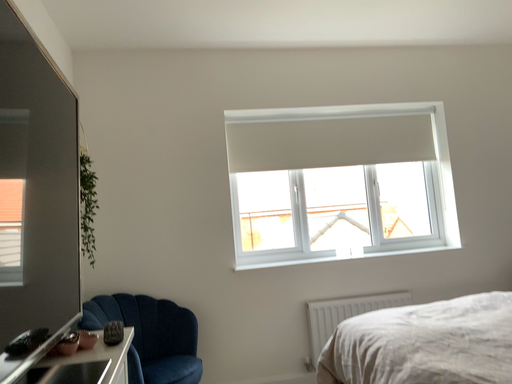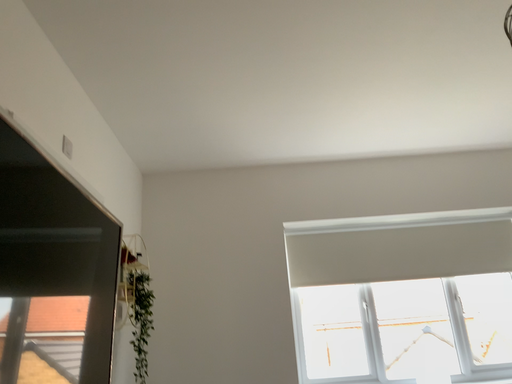
Question: How did the camera likely rotate when shooting the video?

Choices:
 (A) rotated upward
 (B) rotated downward

Answer: (A)